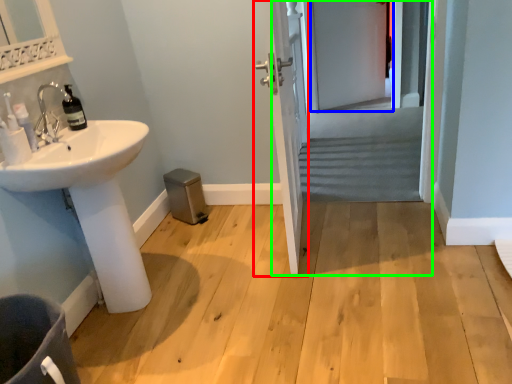
Question: Estimate the real-world distances between objects in this image. Which object is closer to door (highlighted by a red box), screen door (highlighted by a blue box) or screen door (highlighted by a green box)?

Choices:
 (A) screen door
 (B) screen door

Answer: (B)